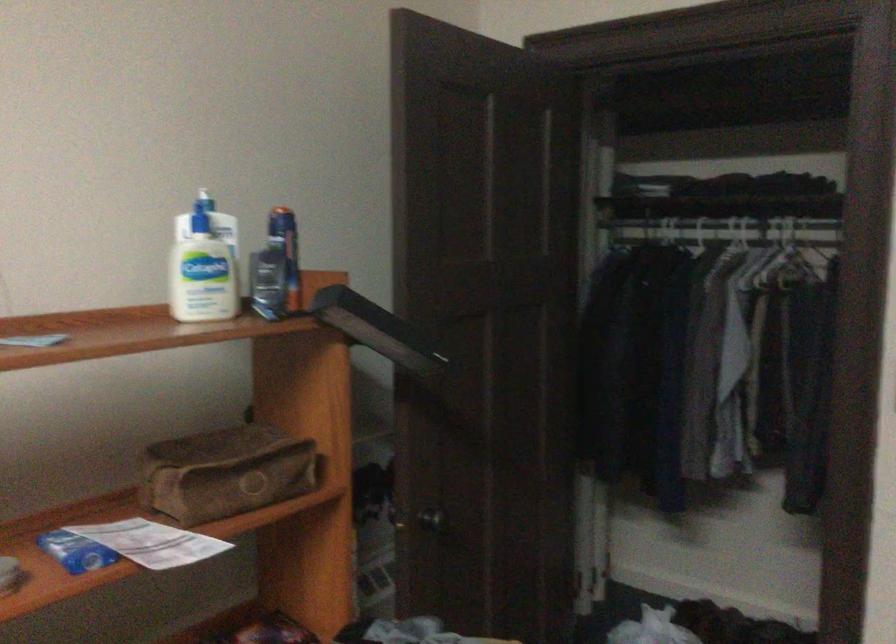
Find where to adjust the black lamp head. Please return your answer as a coordinate pair (x, y).

(373, 491)